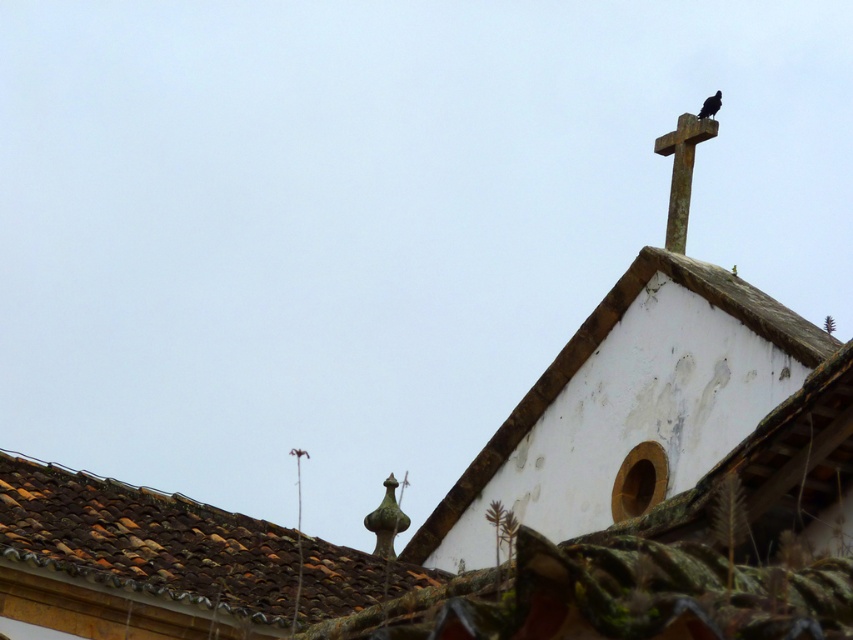
Looking at this image, is smooth stone cross at upper right bigger than black matte bird at upper right?

Indeed, smooth stone cross at upper right has a larger size compared to black matte bird at upper right.

What do you see at coordinates (682, 172) in the screenshot?
I see `smooth stone cross at upper right` at bounding box center [682, 172].

Who is more forward, [677,220] or [711,104]?

Point [677,220] is more forward.

This screenshot has height=640, width=853. Find the location of `smooth stone cross at upper right`. smooth stone cross at upper right is located at coordinates (682, 172).

Who is positioned more to the left, brown clay tiles at upper left or black matte bird at upper right?

From the viewer's perspective, brown clay tiles at upper left appears more on the left side.

Is brown clay tiles at upper left thinner than black matte bird at upper right?

No, brown clay tiles at upper left is not thinner than black matte bird at upper right.

Does point (3, 580) lie in front of point (715, 102)?

Yes, it is.

Locate an element on the screen. This screenshot has height=640, width=853. brown clay tiles at upper left is located at coordinates (134, 561).

Describe the element at coordinates (134, 561) in the screenshot. I see `brown clay tiles at upper left` at that location.

Does brown clay tiles at upper left have a larger size compared to smooth stone cross at upper right?

Yes.

At what (x,y) coordinates should I click in order to perform the action: click on brown clay tiles at upper left. Please return your answer as a coordinate pair (x, y). Looking at the image, I should click on (134, 561).

Where is `brown clay tiles at upper left`? brown clay tiles at upper left is located at coordinates (134, 561).